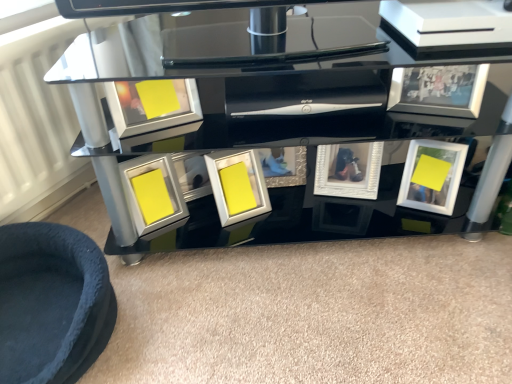
Find the location of a particular element. Image resolution: width=512 pixels, height=384 pixels. vacant space to the right of velvet blue pet bed at lower left is located at coordinates (199, 306).